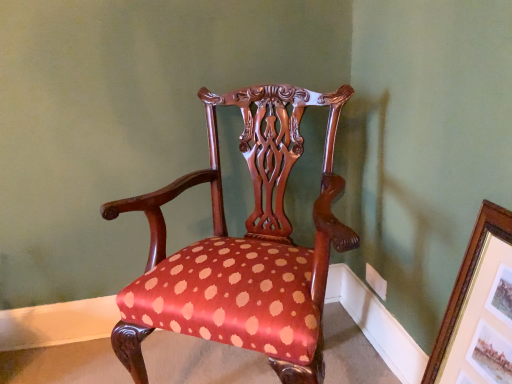
Question: From the image's perspective, is gold/gilded picture frame at upper right above or below polished wood chair at center?

Choices:
 (A) above
 (B) below

Answer: (B)

Question: Relative to polished wood chair at center, is gold/gilded picture frame at upper right in front or behind?

Choices:
 (A) front
 (B) behind

Answer: (A)

Question: Is gold/gilded picture frame at upper right taller or shorter than polished wood chair at center?

Choices:
 (A) short
 (B) tall

Answer: (A)

Question: Is point (247, 91) closer or farther from the camera than point (504, 372)?

Choices:
 (A) farther
 (B) closer

Answer: (A)

Question: In terms of height, does polished wood chair at center look taller or shorter compared to gold/gilded picture frame at upper right?

Choices:
 (A) short
 (B) tall

Answer: (B)

Question: Choose the correct answer: Is polished wood chair at center inside gold/gilded picture frame at upper right or outside it?

Choices:
 (A) outside
 (B) inside

Answer: (A)

Question: From a real-world perspective, is polished wood chair at center physically located above or below gold/gilded picture frame at upper right?

Choices:
 (A) below
 (B) above

Answer: (B)